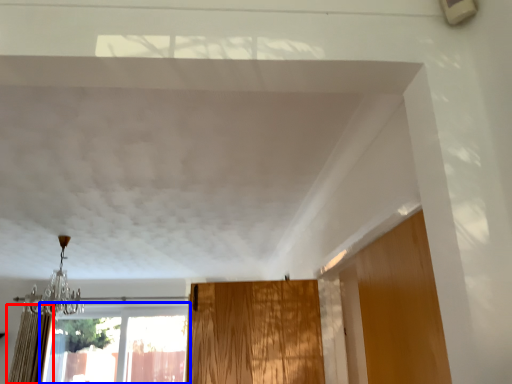
Question: Which object is further to the camera taking this photo, curtain (highlighted by a red box) or window (highlighted by a blue box)?

Choices:
 (A) curtain
 (B) window

Answer: (B)